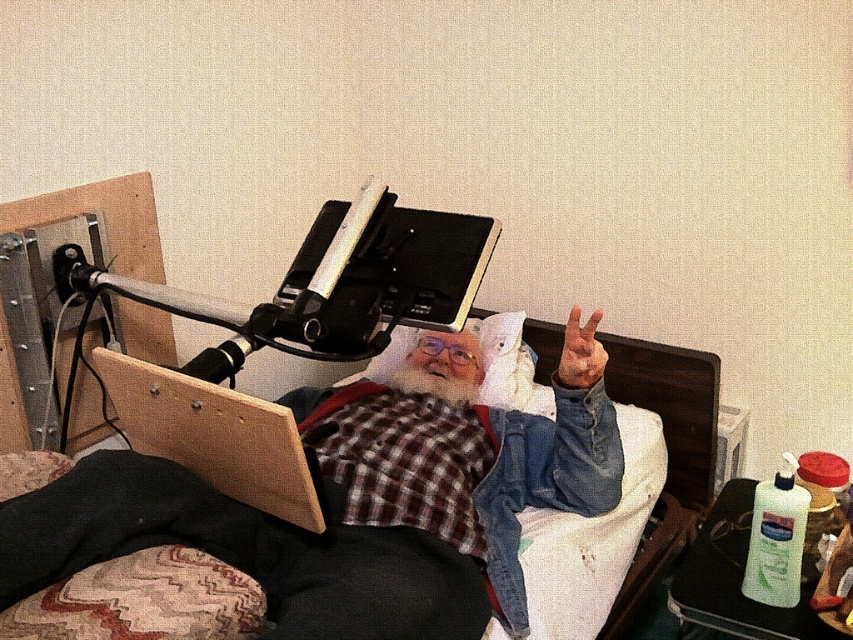
Based on the scene description, which object is bigger between the denim bed at center and the wooden board at lower left?

The denim bed at center is larger in size than the wooden board at lower left.

You are a healthcare worker standing at the foot of the bed. You need to retrieve the wooden board at lower left to write notes. Can you reach it without moving your position? Assume your arm can extend 1 meter.

The wooden board at lower left is 1.12 meters away from the camera. Since your arm can only extend 1 meter, you cannot reach it without moving closer.